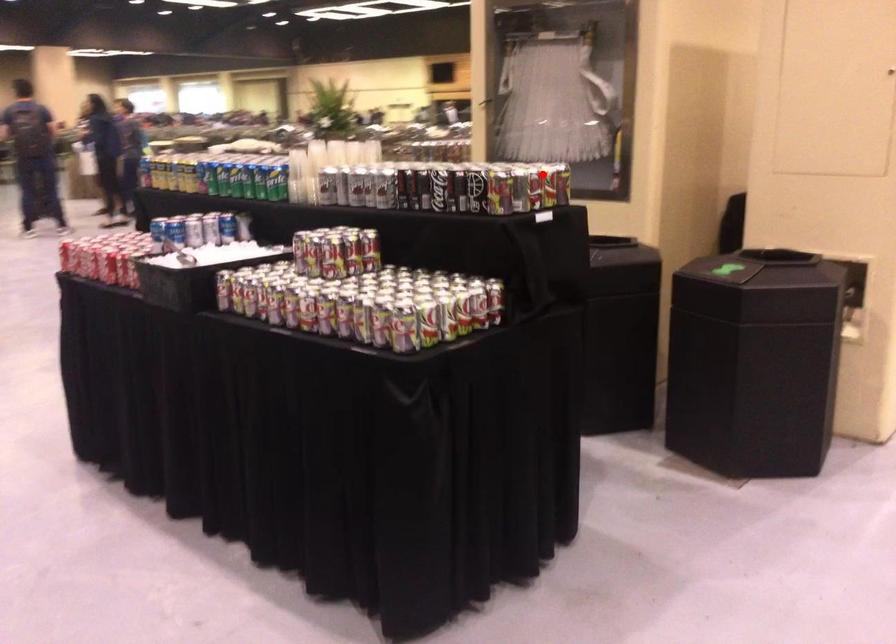
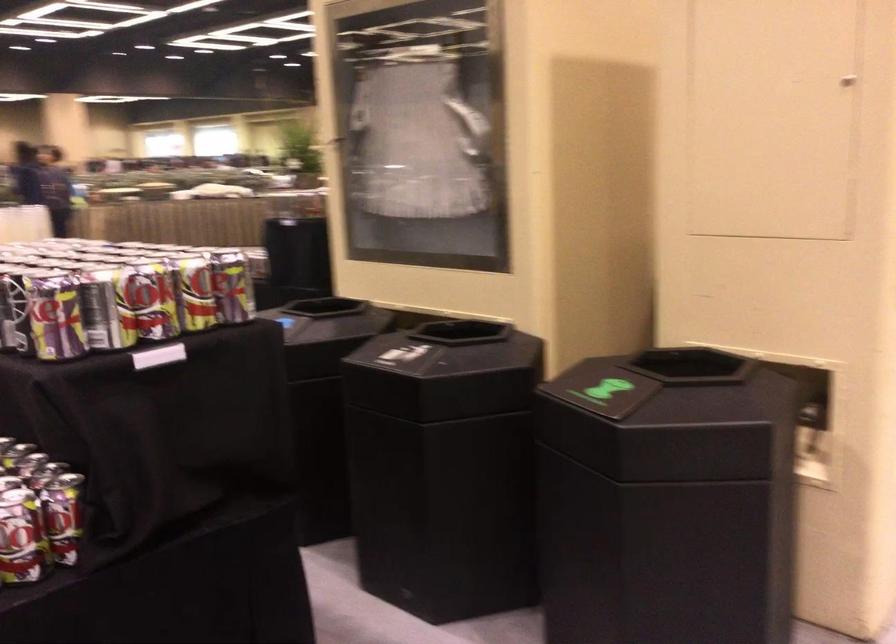
Question: I am providing you with two images of the same scene from different viewpoints. A red point is shown in image1. For the corresponding object point in image2, is it positioned nearer or farther from the camera?

Choices:
 (A) Nearer
 (B) Farther

Answer: (A)